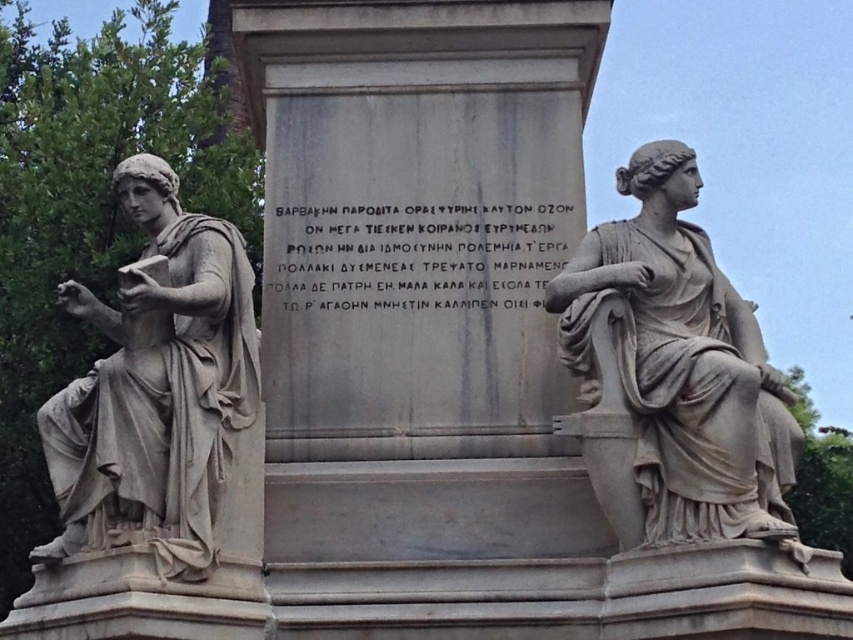
You are standing in front of the monument and want to take a photo of both the matte gray statue at left and the matte gray statue at right. If you turn your camera slightly to the right, which statue will come into the frame first?

The matte gray statue at right will come into the frame first because it is positioned to the right of the matte gray statue at left.

You are an art conservator tasked with moving both the matte gray statue at left and the matte gray statue at right into a storage room. The storage room has a narrow doorway that can only accommodate items up to the width of the narrower statue. Which statue should you move first to ensure it fits through the doorway?

You should move the matte gray statue at left first because its width is narrower than the matte gray statue at right, ensuring it will fit through the doorway.

You are standing in front of the classical monument and want to locate the matte gray statue at right. Based on the coordinate system where the bottom left corner is the origin, can you determine its approximate location?

The matte gray statue at right is located at coordinate point 0.583 along the x axis and 0.792 along the y axis.